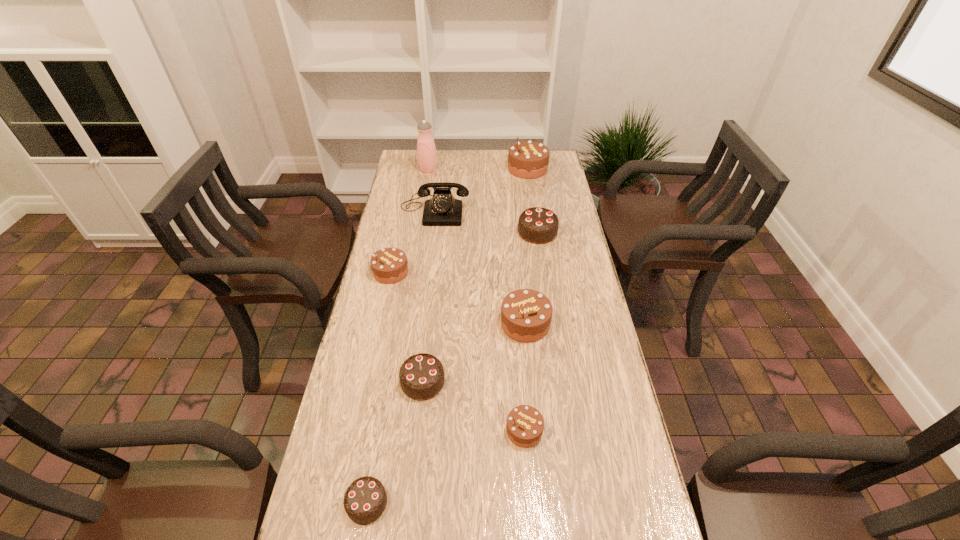
Identify the location of the fifth farthest chocolate cake. The image size is (960, 540). (421, 376).

Find the location of a particular element. This screenshot has height=540, width=960. the second farthest chocolate chocolate cake is located at coordinates (421, 376).

Where is `the sixth farthest chocolate cake`? the sixth farthest chocolate cake is located at coordinates (525, 424).

What are the coordinates of `the nearest brown chocolate cake` in the screenshot? It's located at (525, 424).

Locate an element on the screen. This screenshot has width=960, height=540. the smallest chocolate chocolate cake is located at coordinates (365, 500).

Where is `the nearest chocolate cake`? the nearest chocolate cake is located at coordinates click(x=365, y=500).

Find the location of `vacant point located 0.100m on the back of the tallest object`. vacant point located 0.100m on the back of the tallest object is located at coordinates (431, 154).

Find the location of `free spot located on the front of the farthest brown chocolate cake`. free spot located on the front of the farthest brown chocolate cake is located at coordinates (536, 226).

The height and width of the screenshot is (540, 960). I want to click on vacant area situated on the front face of the telephone, so click(427, 269).

The width and height of the screenshot is (960, 540). I want to click on vacant space situated 0.070m on the right of the second nearest brown chocolate cake, so click(x=573, y=323).